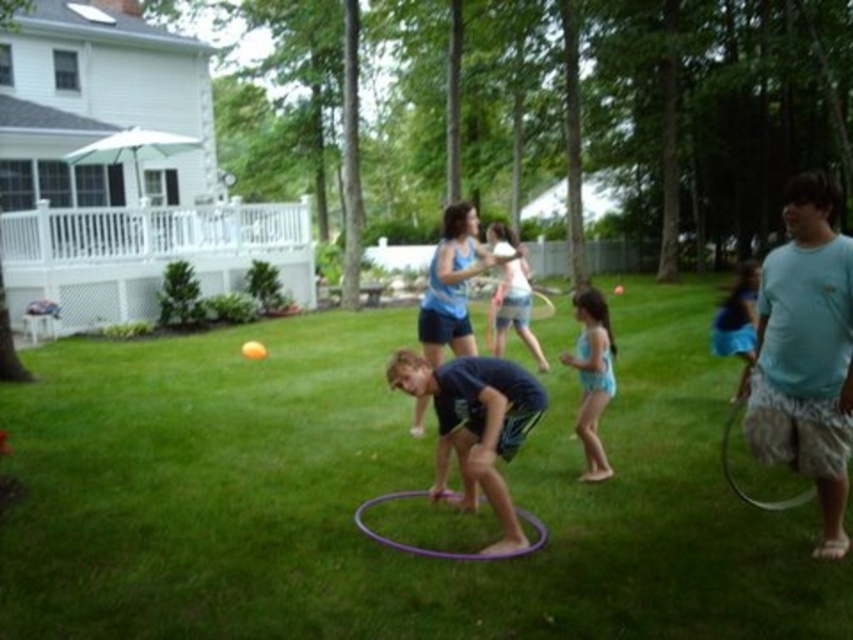
You are a photographer trying to capture a photo of both the blue fabric swimsuit at center and the purple plastic hula hoop at right. Which object should you focus on first to ensure both are in clear view?

The blue fabric swimsuit at center is further to the viewer than the purple plastic hula hoop at right, so you should focus on the blue fabric swimsuit at center first to ensure both are in clear view.